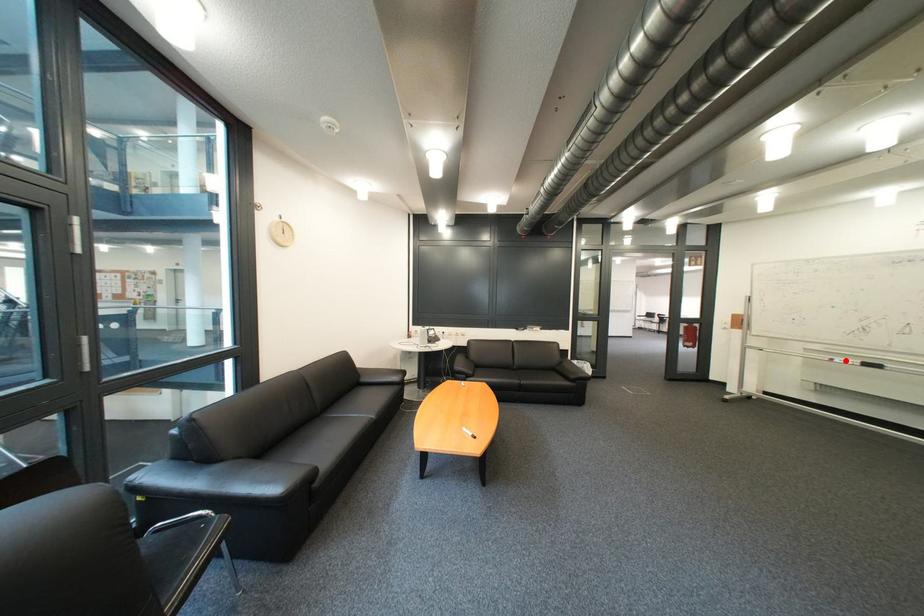
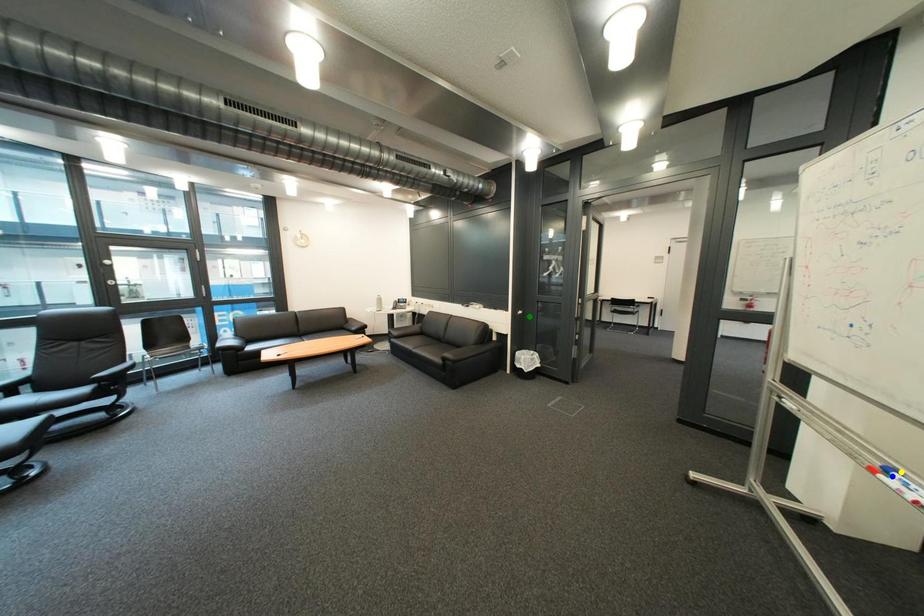
Question: I am providing you with two images of the same scene from different viewpoints. A red point is marked on the first image. You are given multiple points on the second image. Can you choose the point in image 2 that corresponds to the point in image 1?

Choices:
 (A) green point
 (B) yellow point
 (C) blue point

Answer: (B)